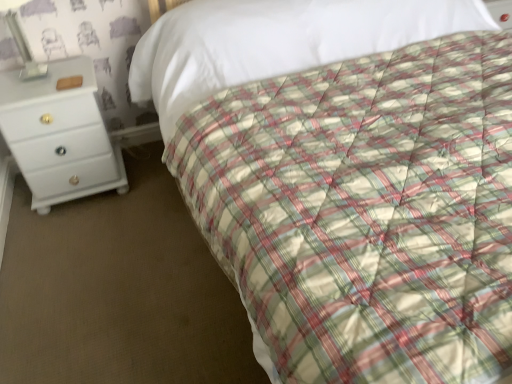
Question: Should I look upward or downward to see white glossy chest of drawers at left?

Choices:
 (A) up
 (B) down

Answer: (A)

Question: Is metallic silver lamp at upper left thinner than white glossy chest of drawers at left?

Choices:
 (A) yes
 (B) no

Answer: (A)

Question: Is metallic silver lamp at upper left oriented towards white glossy chest of drawers at left?

Choices:
 (A) yes
 (B) no

Answer: (B)

Question: Does metallic silver lamp at upper left appear on the right side of white glossy chest of drawers at left?

Choices:
 (A) yes
 (B) no

Answer: (B)

Question: Does metallic silver lamp at upper left have a smaller size compared to white glossy chest of drawers at left?

Choices:
 (A) no
 (B) yes

Answer: (B)

Question: Does metallic silver lamp at upper left come in front of white glossy chest of drawers at left?

Choices:
 (A) no
 (B) yes

Answer: (B)

Question: Is metallic silver lamp at upper left behind white glossy chest of drawers at left?

Choices:
 (A) no
 (B) yes

Answer: (A)

Question: Is white glossy chest of drawers at left next to metallic silver lamp at upper left and touching it?

Choices:
 (A) no
 (B) yes

Answer: (A)

Question: Is white glossy chest of drawers at left outside of metallic silver lamp at upper left?

Choices:
 (A) yes
 (B) no

Answer: (A)

Question: Is white glossy chest of drawers at left to the left of metallic silver lamp at upper left from the viewer's perspective?

Choices:
 (A) yes
 (B) no

Answer: (B)

Question: Does white glossy chest of drawers at left turn towards metallic silver lamp at upper left?

Choices:
 (A) yes
 (B) no

Answer: (B)

Question: Does white glossy chest of drawers at left have a greater height compared to metallic silver lamp at upper left?

Choices:
 (A) no
 (B) yes

Answer: (B)

Question: From a real-world perspective, is white glossy chest of drawers at left beneath metallic silver lamp at upper left?

Choices:
 (A) yes
 (B) no

Answer: (A)

Question: Which is correct: white glossy chest of drawers at left is inside metallic silver lamp at upper left, or outside of it?

Choices:
 (A) inside
 (B) outside

Answer: (B)